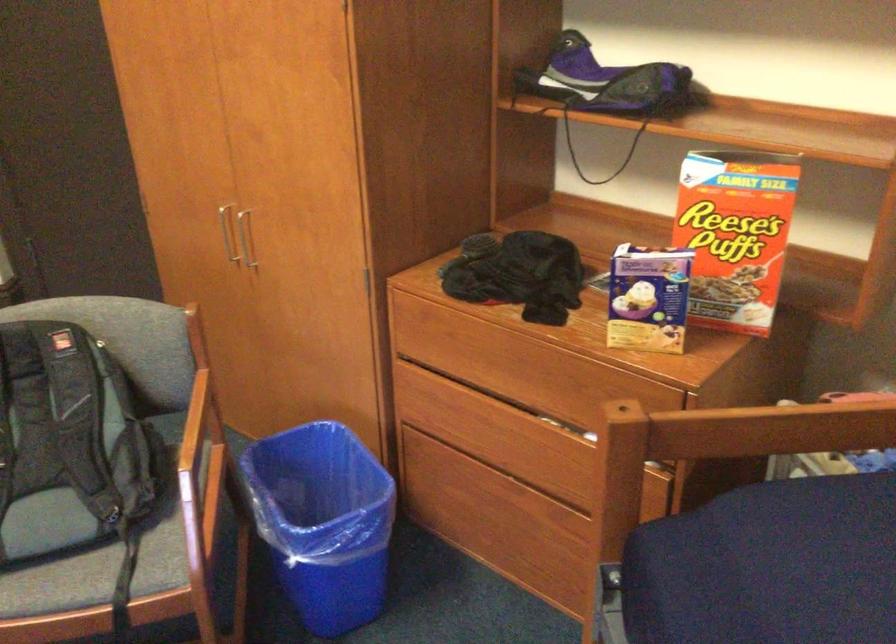
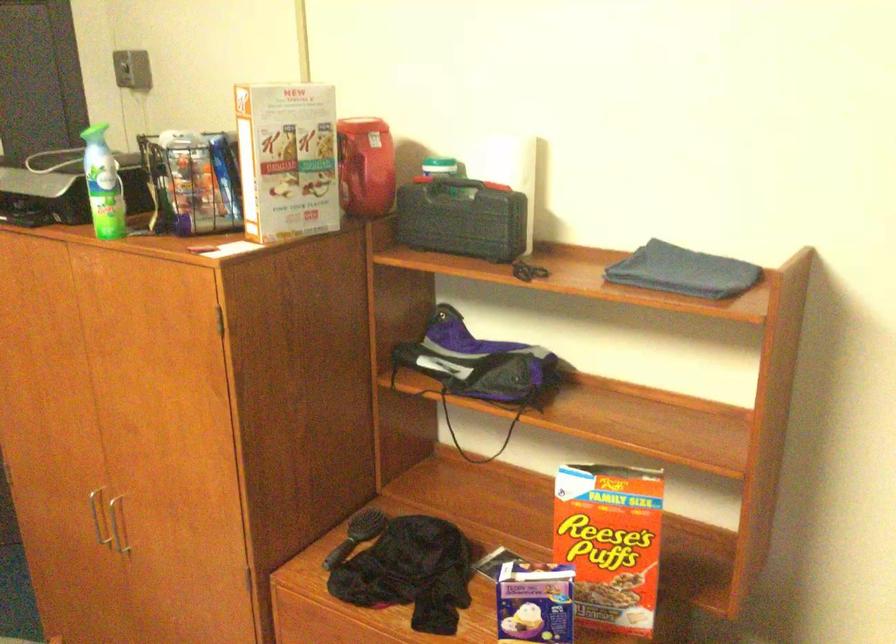
Question: The first image is from the beginning of the video and the second image is from the end. How did the camera likely rotate when shooting the video?

Choices:
 (A) Left
 (B) Right
 (C) Up
 (D) Down

Answer: (C)